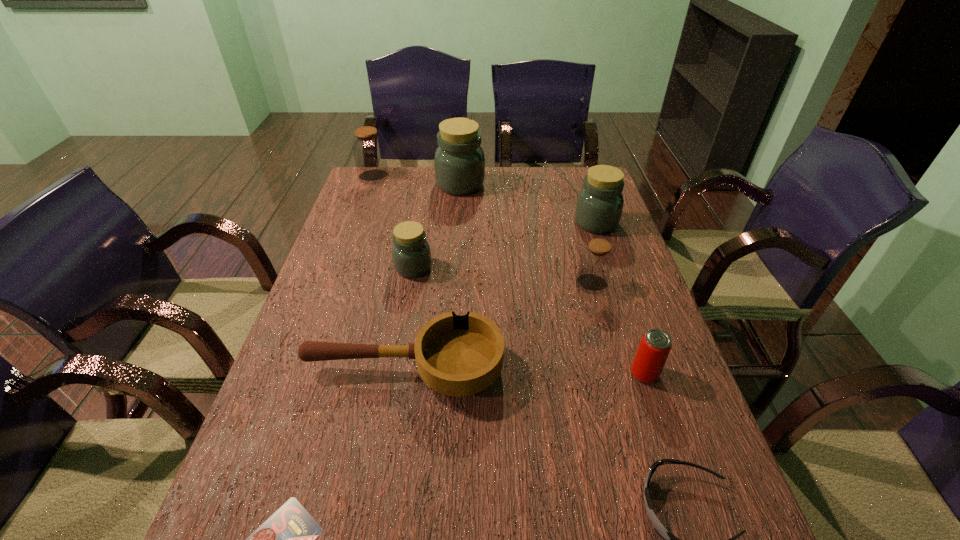
Identify the location of free spot that satisfies the following two spatial constraints: 1. on the back side of the second smallest green jar; 2. on the right side of the right brown jar. The image size is (960, 540). (575, 223).

Image resolution: width=960 pixels, height=540 pixels. I want to click on free space that satisfies the following two spatial constraints: 1. on the front side of the right brown jar; 2. on the right side of the smallest green jar, so click(x=411, y=284).

You are a GUI agent. You are given a task and a screenshot of the screen. Output one action in this format:
    pyautogui.click(x=<x>, y=<y>)
    Task: Click on the free point that satisfies the following two spatial constraints: 1. with the handle on the side of the seventh tallest object; 2. on the right side of the second farthest green jar
    This screenshot has width=960, height=540.
    Given the screenshot: What is the action you would take?
    pyautogui.click(x=427, y=223)

This screenshot has height=540, width=960. I want to click on vacant region that satisfies the following two spatial constraints: 1. on the front side of the farthest green jar; 2. on the right side of the beer can, so click(x=448, y=374).

What are the coordinates of `vacant space that satisfies the following two spatial constraints: 1. on the front side of the smallest green jar; 2. with the handle on the side of the third shortest object` in the screenshot? It's located at (396, 369).